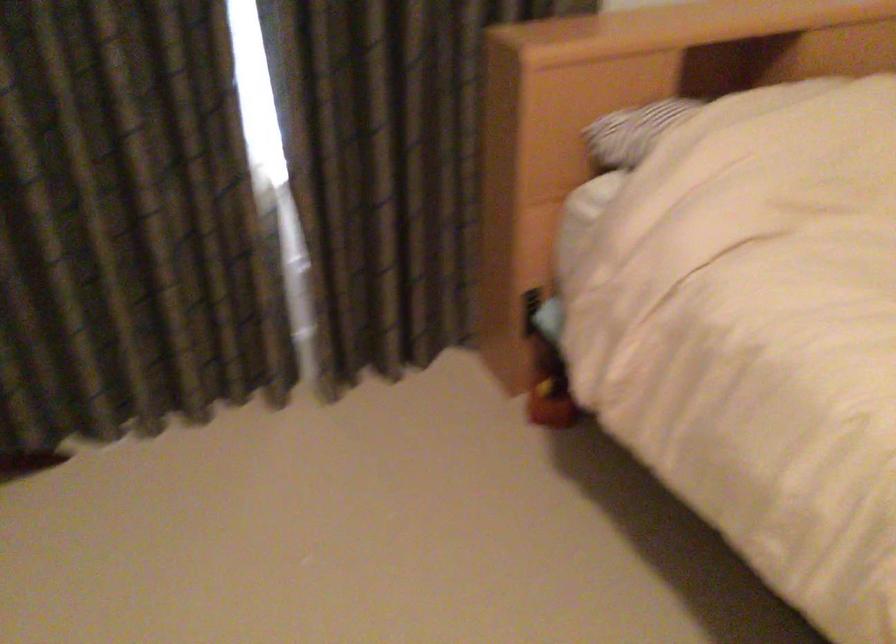
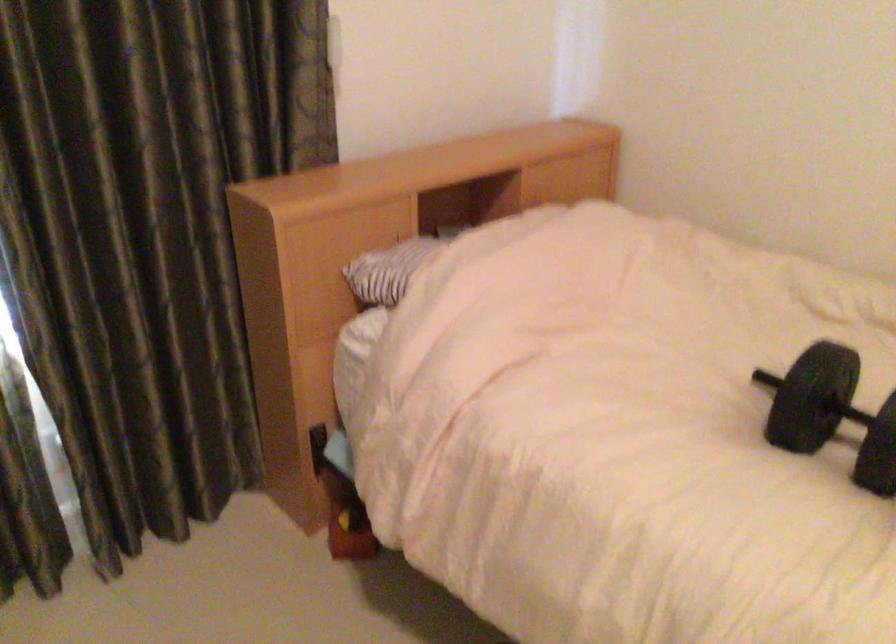
The images are taken continuously from a first-person perspective. In which direction are you moving?

The movement direction of the cameraman is right, backward.